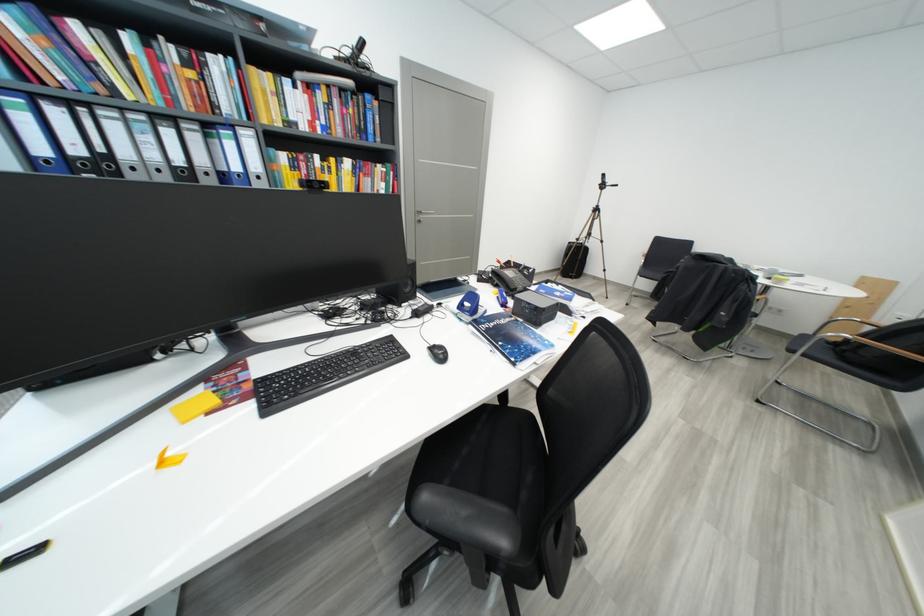
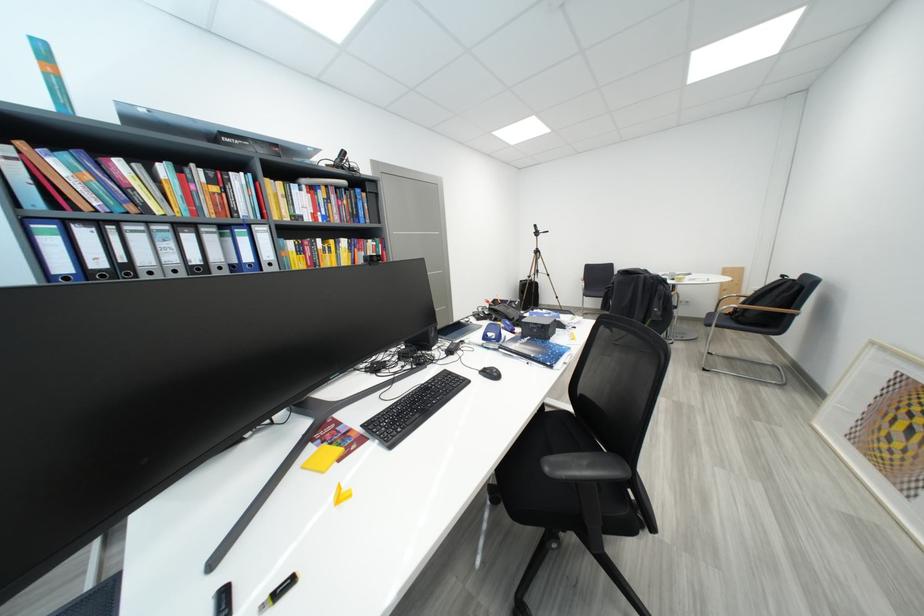
Which direction would the cameraman need to move to produce the second image?

The movement direction of the cameraman is left, backward.